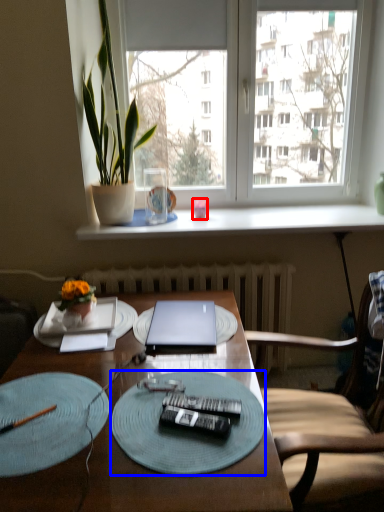
Question: Which object appears farthest to the camera in this image, coffee cup (highlighted by a red box) or glass plate (highlighted by a blue box)?

Choices:
 (A) coffee cup
 (B) glass plate

Answer: (A)